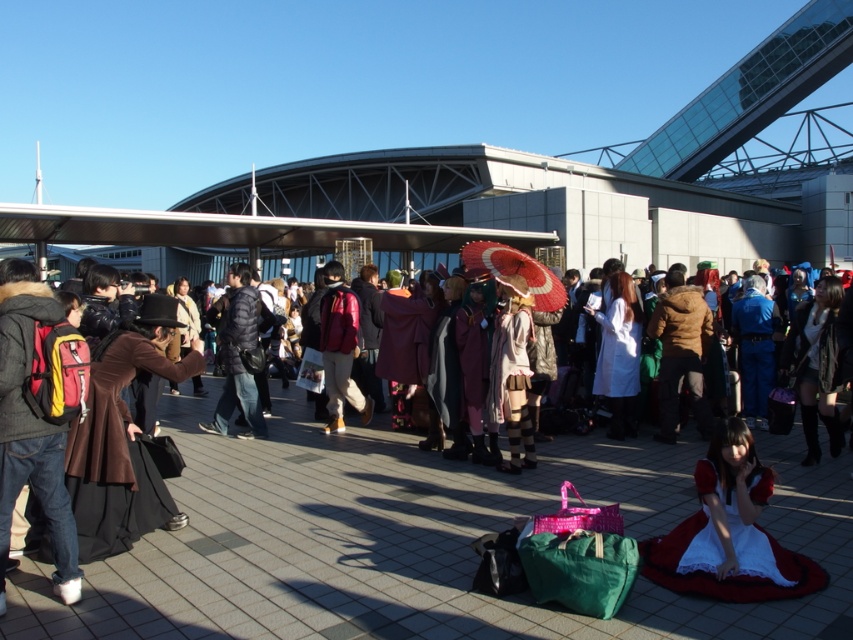
Question: Does white satin dress at lower right appear over matte red backpack at left?

Choices:
 (A) no
 (B) yes

Answer: (A)

Question: Is brown leather coat at center behind matte red backpack at left?

Choices:
 (A) no
 (B) yes

Answer: (A)

Question: Which object is positioned farthest from the white satin dress at lower right?

Choices:
 (A) matte red backpack at left
 (B) brown leather coat at center

Answer: (A)

Question: Which object is closer to the camera taking this photo?

Choices:
 (A) brown leather coat at center
 (B) matte red backpack at left

Answer: (A)

Question: Which of the following is the farthest from the observer?

Choices:
 (A) (25, 355)
 (B) (265, 472)
 (C) (711, 484)

Answer: (B)

Question: Is white satin dress at lower right to the left of matte red backpack at left from the viewer's perspective?

Choices:
 (A) yes
 (B) no

Answer: (B)